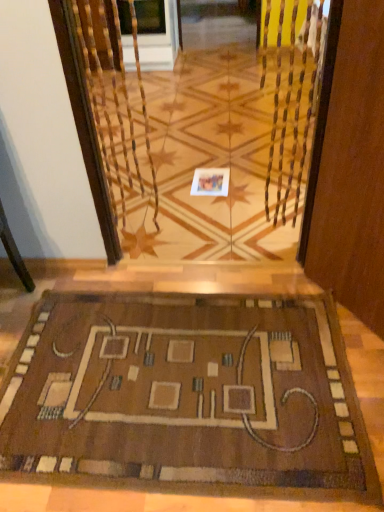
Question: Is white paper at center looking in the opposite direction of transparent glass door at center?

Choices:
 (A) yes
 (B) no

Answer: (B)

Question: From a real-world perspective, does white paper at center stand above transparent glass door at center?

Choices:
 (A) no
 (B) yes

Answer: (A)

Question: From the image's perspective, is white paper at center above transparent glass door at center?

Choices:
 (A) yes
 (B) no

Answer: (A)

Question: Is white paper at center beside transparent glass door at center?

Choices:
 (A) no
 (B) yes

Answer: (A)

Question: Does white paper at center have a greater height compared to transparent glass door at center?

Choices:
 (A) yes
 (B) no

Answer: (B)

Question: Can you confirm if white paper at center is smaller than transparent glass door at center?

Choices:
 (A) yes
 (B) no

Answer: (A)

Question: Does white paper at center have a greater width compared to brown woven mat at lower center?

Choices:
 (A) yes
 (B) no

Answer: (B)

Question: Can you confirm if white paper at center is bigger than brown woven mat at lower center?

Choices:
 (A) no
 (B) yes

Answer: (A)

Question: From a real-world perspective, does white paper at center stand above brown woven mat at lower center?

Choices:
 (A) no
 (B) yes

Answer: (A)

Question: Is white paper at center to the right of brown woven mat at lower center from the viewer's perspective?

Choices:
 (A) yes
 (B) no

Answer: (A)

Question: Is white paper at center far from brown woven mat at lower center?

Choices:
 (A) yes
 (B) no

Answer: (A)

Question: Does white paper at center have a smaller size compared to brown woven mat at lower center?

Choices:
 (A) no
 (B) yes

Answer: (B)

Question: Is transparent glass door at center not inside white paper at center?

Choices:
 (A) no
 (B) yes

Answer: (B)